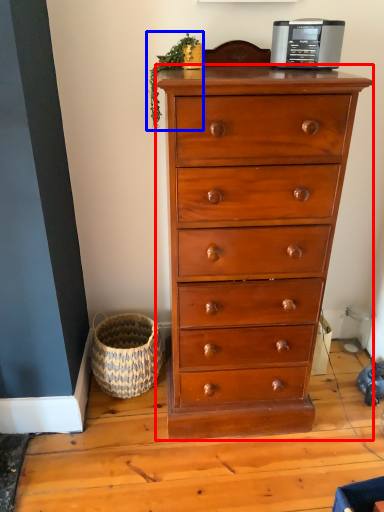
Question: Which object is further to the camera taking this photo, chest of drawers (highlighted by a red box) or plant (highlighted by a blue box)?

Choices:
 (A) chest of drawers
 (B) plant

Answer: (B)